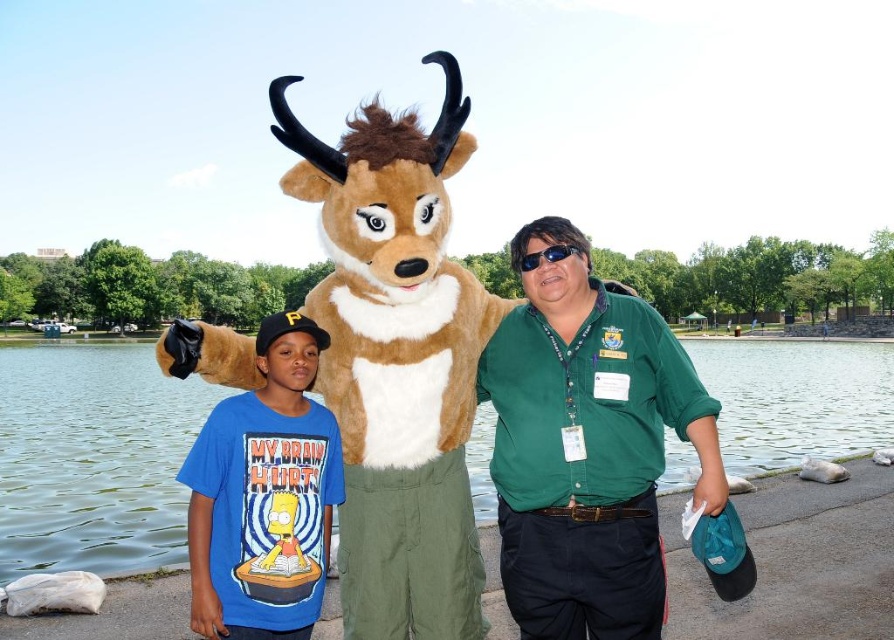
Which is below, clear water at lake center or blue cotton t-shirt at center?

clear water at lake center is lower down.

From the picture: Is clear water at lake center further to camera compared to blue cotton t-shirt at center?

That is True.

Locate an element on the screen. clear water at lake center is located at coordinates (91, 458).

In the scene shown: Which is below, blue cotton t-shirt at center or black plastic goggles at center?

blue cotton t-shirt at center is below.

Can you confirm if blue cotton t-shirt at center is smaller than black plastic goggles at center?

Yes.

Describe the element at coordinates (264, 496) in the screenshot. Image resolution: width=894 pixels, height=640 pixels. I see `blue cotton t-shirt at center` at that location.

I want to click on blue cotton t-shirt at center, so click(264, 496).

Who is more forward, (661, 550) or (530, 262)?

Positioned in front is point (661, 550).

Is green fabric shirt at center wider than black plastic goggles at center?

Yes, green fabric shirt at center is wider than black plastic goggles at center.

In order to click on green fabric shirt at center in this screenshot , I will do `click(587, 445)`.